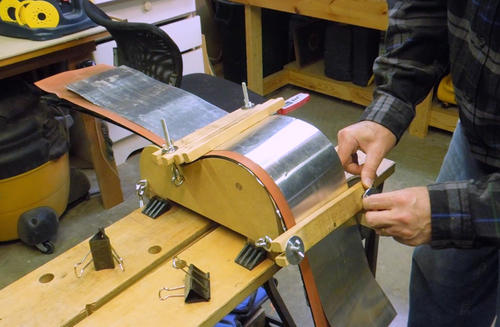
Identify the location of bench legs. (94, 181), (254, 55), (423, 111), (312, 301), (275, 301).